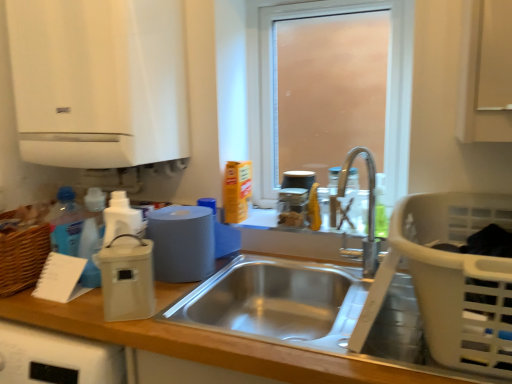
Describe the element at coordinates (273, 86) in the screenshot. I see `frosted glass window at center` at that location.

The image size is (512, 384). Describe the element at coordinates (127, 279) in the screenshot. I see `beige plastic container at left, the third appliance positioned from the back` at that location.

How much space does translucent plastic soap dispenser at upper right, acting as the 2th bottle starting from the left, occupy horizontally?

It is 3.93 inches.

In order to face translucent glass jars at upper center, the 1th appliance when ordered from right to left, should I rotate leftwards or rightwards?

A 4.937 degree turn to the right will do.

I want to click on frosted glass window at center, so click(x=273, y=86).

Does frosted glass window at center appear on the left side of beige plastic container at left, the 1th appliance positioned from the left?

No, frosted glass window at center is not to the left of beige plastic container at left, the 1th appliance positioned from the left.

From a real-world perspective, which is physically above, frosted glass window at center or beige plastic container at left, the 1th appliance positioned from the left?

frosted glass window at center, from a real-world perspective.

Would you consider frosted glass window at center to be distant from beige plastic container at left, which is the 1th appliance in front-to-back order?

No, frosted glass window at center is not far away from beige plastic container at left, which is the 1th appliance in front-to-back order.

Considering the relative sizes of frosted glass window at center and beige plastic container at left, the 1th appliance positioned from the left, in the image provided, is frosted glass window at center shorter than beige plastic container at left, the 1th appliance positioned from the left,?

No, frosted glass window at center is not shorter than beige plastic container at left, the 1th appliance positioned from the left.

Where is `basket below the white matte vent at upper left (from a real-world perspective)`? The height and width of the screenshot is (384, 512). basket below the white matte vent at upper left (from a real-world perspective) is located at coordinates (458, 278).

Considering the relative sizes of white matte vent at upper left and white plastic laundry basket at lower right in the image provided, is white matte vent at upper left smaller than white plastic laundry basket at lower right?

No.

Is white matte vent at upper left not near white plastic laundry basket at lower right?

They are positioned close to each other.

From the image's perspective, is white matte vent at upper left located beneath white plastic laundry basket at lower right?

No, from the image's perspective, white matte vent at upper left is not beneath white plastic laundry basket at lower right.

Considering the relative sizes of clear glass bottle at sink, marked as the second bottle in a right-to-left arrangement, and wooden at left in the image provided, is clear glass bottle at sink, marked as the second bottle in a right-to-left arrangement, shorter than wooden at left?

Yes.

Image resolution: width=512 pixels, height=384 pixels. Find the location of `bottle that is the 2nd one when counting backward from the wooden at left`. bottle that is the 2nd one when counting backward from the wooden at left is located at coordinates (344, 197).

Considering the relative positions of clear glass bottle at sink, marked as the second bottle in a right-to-left arrangement, and wooden at left in the image provided, is clear glass bottle at sink, marked as the second bottle in a right-to-left arrangement, in front of wooden at left?

No, it is not.

Consider the image. From the image's perspective, does clear glass bottle at sink, marked as the second bottle in a right-to-left arrangement, appear higher than wooden at left?

Correct, clear glass bottle at sink, marked as the second bottle in a right-to-left arrangement, appears higher than wooden at left in the image.

Is stainless steel sink at center at the left side of wooden at left?

Incorrect, stainless steel sink at center is not on the left side of wooden at left.

From a real-world perspective, is stainless steel sink at center physically above wooden at left?

Correct, in the physical world, stainless steel sink at center is higher than wooden at left.

Is stainless steel sink at center looking in the opposite direction of wooden at left?

That's right, stainless steel sink at center is facing away from wooden at left.

Is stainless steel sink at center not within wooden at left?

Actually, stainless steel sink at center is within wooden at left.

Is frosted glass window at center outside of translucent glass jars at upper center, the 1th appliance when ordered from right to left?

Yes, frosted glass window at center is outside of translucent glass jars at upper center, the 1th appliance when ordered from right to left.

The image size is (512, 384). I want to click on appliance behind the frosted glass window at center, so click(x=292, y=207).

Is frosted glass window at center placed right next to translucent glass jars at upper center, which is the 3th appliance from front to back?

There is a gap between frosted glass window at center and translucent glass jars at upper center, which is the 3th appliance from front to back.

Does frosted glass window at center turn towards translucent glass jars at upper center, acting as the first appliance starting from the back?

Yes, frosted glass window at center is facing translucent glass jars at upper center, acting as the first appliance starting from the back.

Visually, is beige plastic container at left, the 1th appliance positioned from the left, positioned to the left or to the right of wooden at left?

Based on their positions, beige plastic container at left, the 1th appliance positioned from the left, is located to the left of wooden at left.

Considering the sizes of objects beige plastic container at left, the third appliance positioned from the back, and wooden at left in the image provided, who is wider, beige plastic container at left, the third appliance positioned from the back, or wooden at left?

Wider between the two is wooden at left.

From the picture: Is there a large distance between beige plastic container at left, the 1th appliance positioned from the left, and wooden at left?

No, beige plastic container at left, the 1th appliance positioned from the left, is in close proximity to wooden at left.

At what (x,y) coordinates should I click in order to perform the action: click on appliance that is the 1st object located above the wooden at left (from the image's perspective). Please return your answer as a coordinate pair (x, y). Image resolution: width=512 pixels, height=384 pixels. Looking at the image, I should click on (127, 279).

From a real-world perspective, relative to translucent glass jars at upper center, acting as the first appliance starting from the back, is stainless steel sink at center vertically above or below?

stainless steel sink at center is below translucent glass jars at upper center, acting as the first appliance starting from the back.

Can you tell me how much stainless steel sink at center and translucent glass jars at upper center, which is the 3th appliance from front to back, differ in facing direction?

stainless steel sink at center and translucent glass jars at upper center, which is the 3th appliance from front to back, are facing 0.76 degrees away from each other.

Is stainless steel sink at center not within translucent glass jars at upper center, which is the 3th appliance from front to back?

Yes, stainless steel sink at center is outside of translucent glass jars at upper center, which is the 3th appliance from front to back.

From the image's perspective, which is above, stainless steel sink at center or translucent glass jars at upper center, the 1th appliance when ordered from right to left?

translucent glass jars at upper center, the 1th appliance when ordered from right to left, appears higher in the image.

From a real-world perspective, count 2nd appliances downward from the frosted glass window at center and point to it. Please provide its 2D coordinates.

[(127, 279)]

This screenshot has width=512, height=384. Find the location of `vent located behind the white plastic laundry basket at lower right`. vent located behind the white plastic laundry basket at lower right is located at coordinates (99, 81).

From the image, which object appears to be farther from translucent glass jars at upper center, the 1th appliance when ordered from right to left, translucent plastic soap dispenser at upper right, acting as the 2th bottle starting from the left, or matte plastic roll of paper at center, acting as the second appliance starting from the back?

Based on the image, matte plastic roll of paper at center, acting as the second appliance starting from the back, appears to be further to translucent glass jars at upper center, the 1th appliance when ordered from right to left.

Looking at the image, which one is located closer to clear glass bottle at sink, marked as the second bottle in a right-to-left arrangement, translucent plastic soap dispenser at upper right, the first bottle viewed from the right, or frosted glass window at center?

Based on the image, translucent plastic soap dispenser at upper right, the first bottle viewed from the right, appears to be nearer to clear glass bottle at sink, marked as the second bottle in a right-to-left arrangement.

Based on their spatial positions, is translucent glass jars at upper center, which is the 3th appliance from front to back, or wooden at left closer to stainless steel sink at center?

Based on the image, wooden at left appears to be nearer to stainless steel sink at center.

Looking at the image, which one is located further to translucent glass jars at upper center, which is the 3th appliance from front to back, white matte vent at upper left or stainless steel sink at center?

Among the two, white matte vent at upper left is located further to translucent glass jars at upper center, which is the 3th appliance from front to back.

Estimate the real-world distances between objects in this image. Which object is closer to translucent glass jars at upper center, acting as the first appliance starting from the back, stainless steel sink at center or white plastic laundry basket at lower right?

The object closer to translucent glass jars at upper center, acting as the first appliance starting from the back, is stainless steel sink at center.

Looking at the image, which one is located further to white matte vent at upper left, frosted glass window at center or wooden at left?

wooden at left is further to white matte vent at upper left.

Estimate the real-world distances between objects in this image. Which object is closer to wooden at left, white plastic laundry basket at lower right or frosted glass window at center?

Among the two, white plastic laundry basket at lower right is located nearer to wooden at left.

Looking at the image, which one is located closer to stainless steel sink at center, clear glass bottle at sink, marked as the second bottle in a right-to-left arrangement, or translucent plastic soap dispenser at upper right, acting as the 2th bottle starting from the left?

clear glass bottle at sink, marked as the second bottle in a right-to-left arrangement.

Locate an element on the screen. Image resolution: width=512 pixels, height=384 pixels. sink between beige plastic container at left, the 1th appliance positioned from the left, and clear glass bottle at sink, positioned as the 1th bottle in left-to-right order, from left to right is located at coordinates (302, 308).

Where is `bottle located between matte plastic roll of paper at center, the 2th appliance in the left-to-right sequence, and translucent plastic soap dispenser at upper right, acting as the 2th bottle starting from the left, in the left-right direction`? The width and height of the screenshot is (512, 384). bottle located between matte plastic roll of paper at center, the 2th appliance in the left-to-right sequence, and translucent plastic soap dispenser at upper right, acting as the 2th bottle starting from the left, in the left-right direction is located at coordinates (344, 197).

Locate an element on the screen. This screenshot has width=512, height=384. sink between wooden at left and white plastic laundry basket at lower right from left to right is located at coordinates (302, 308).

Where is `sink between white matte vent at upper left and wooden at left in the up-down direction`? The image size is (512, 384). sink between white matte vent at upper left and wooden at left in the up-down direction is located at coordinates (302, 308).